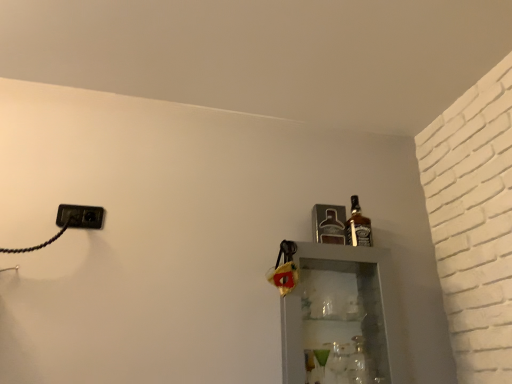
What is the approximate width of brown glass bottle at upper right, marked as the 1th bottle in a top-to-bottom arrangement?

It is 2.09 inches.

What is the approximate height of black plastic outlet at left?

9.02 centimeters.

Identify the location of metallic silver bottle at upper right, arranged as the 2th bottle when viewed from the top. (331, 225).

Are black plastic outlet at left and metallic silver bottle at upper right, arranged as the 2th bottle when viewed from the top, located far from each other?

No, there isn't a large distance between black plastic outlet at left and metallic silver bottle at upper right, arranged as the 2th bottle when viewed from the top.

How many degrees apart are the facing directions of black plastic outlet at left and metallic silver bottle at upper right, the 2th bottle when ordered from bottom to top?

The angular difference between black plastic outlet at left and metallic silver bottle at upper right, the 2th bottle when ordered from bottom to top, is 4.3 degrees.

Is point (65, 215) closer to viewer compared to point (331, 231)?

Yes, point (65, 215) is in front of point (331, 231).

Measure the distance between black plastic outlet at left and metallic silver bottle at upper right, the 2th bottle when ordered from bottom to top.

black plastic outlet at left and metallic silver bottle at upper right, the 2th bottle when ordered from bottom to top, are 34.85 inches apart from each other.

In the image, is clear glass bottle at right, the first bottle in the bottom-to-top sequence, positioned in front of or behind metallic silver bottle at upper right, the 2th bottle when ordered from bottom to top?

Visually, clear glass bottle at right, the first bottle in the bottom-to-top sequence, is located in front of metallic silver bottle at upper right, the 2th bottle when ordered from bottom to top.

From the image's perspective, is clear glass bottle at right, marked as the third bottle in a top-to-bottom arrangement, over metallic silver bottle at upper right, the 2th bottle when ordered from bottom to top?

No, from the image's perspective, clear glass bottle at right, marked as the third bottle in a top-to-bottom arrangement, is not on top of metallic silver bottle at upper right, the 2th bottle when ordered from bottom to top.

Where is `bottle located underneath the metallic silver bottle at upper right, the 2th bottle when ordered from bottom to top (from a real-world perspective)`? bottle located underneath the metallic silver bottle at upper right, the 2th bottle when ordered from bottom to top (from a real-world perspective) is located at coordinates (358, 363).

From a real-world perspective, is clear glass bottle at right, marked as the third bottle in a top-to-bottom arrangement, located higher than metallic silver bottle at upper right, the 2th bottle when ordered from bottom to top?

No.

This screenshot has width=512, height=384. What are the coordinates of `bottle that appears behind the brown glass bottle at upper right, marked as the 1th bottle in a top-to-bottom arrangement` in the screenshot? It's located at (331, 225).

Considering the sizes of objects metallic silver bottle at upper right, the 2th bottle when ordered from bottom to top, and brown glass bottle at upper right, marked as the 1th bottle in a top-to-bottom arrangement, in the image provided, who is thinner, metallic silver bottle at upper right, the 2th bottle when ordered from bottom to top, or brown glass bottle at upper right, marked as the 1th bottle in a top-to-bottom arrangement,?

With smaller width is brown glass bottle at upper right, marked as the 1th bottle in a top-to-bottom arrangement.

From the picture: Is metallic silver bottle at upper right, the 2th bottle when ordered from bottom to top, closer to the viewer compared to brown glass bottle at upper right, marked as the 1th bottle in a top-to-bottom arrangement?

No, metallic silver bottle at upper right, the 2th bottle when ordered from bottom to top, is further to the viewer.

Is metallic silver bottle at upper right, arranged as the 2th bottle when viewed from the top, positioned with its back to brown glass bottle at upper right, marked as the third bottle in a bottom-to-top arrangement?

No, metallic silver bottle at upper right, arranged as the 2th bottle when viewed from the top, is not facing the opposite direction of brown glass bottle at upper right, marked as the third bottle in a bottom-to-top arrangement.

Consider the image. Relative to black plastic outlet at left, is brown glass bottle at upper right, marked as the 1th bottle in a top-to-bottom arrangement, in front or behind?

brown glass bottle at upper right, marked as the 1th bottle in a top-to-bottom arrangement, is behind black plastic outlet at left.

Looking at this image, considering the relative positions of brown glass bottle at upper right, marked as the 1th bottle in a top-to-bottom arrangement, and black plastic outlet at left in the image provided, is brown glass bottle at upper right, marked as the 1th bottle in a top-to-bottom arrangement, to the right of black plastic outlet at left from the viewer's perspective?

Yes, brown glass bottle at upper right, marked as the 1th bottle in a top-to-bottom arrangement, is to the right of black plastic outlet at left.

From a real-world perspective, which object stands above the other?

brown glass bottle at upper right, marked as the 1th bottle in a top-to-bottom arrangement.

Considering the relative sizes of brown glass bottle at upper right, marked as the 1th bottle in a top-to-bottom arrangement, and clear glass bottle at right, marked as the third bottle in a top-to-bottom arrangement, in the image provided, is brown glass bottle at upper right, marked as the 1th bottle in a top-to-bottom arrangement, smaller than clear glass bottle at right, marked as the third bottle in a top-to-bottom arrangement,?

Incorrect, brown glass bottle at upper right, marked as the 1th bottle in a top-to-bottom arrangement, is not smaller in size than clear glass bottle at right, marked as the third bottle in a top-to-bottom arrangement.

Does point (364, 222) appear closer or farther from the camera than point (354, 383)?

Point (364, 222).

Would you say clear glass bottle at right, marked as the third bottle in a top-to-bottom arrangement, is part of brown glass bottle at upper right, marked as the 1th bottle in a top-to-bottom arrangement,'s contents?

No, clear glass bottle at right, marked as the third bottle in a top-to-bottom arrangement, is not inside brown glass bottle at upper right, marked as the 1th bottle in a top-to-bottom arrangement.

Looking at this image, how many degrees apart are the facing directions of brown glass bottle at upper right, marked as the 1th bottle in a top-to-bottom arrangement, and clear glass bottle at right, the first bottle in the bottom-to-top sequence?

They differ by 2.63 degrees in their facing directions.

Is metallic silver bottle at upper right, the 2th bottle when ordered from bottom to top, oriented towards black plastic outlet at left?

No, metallic silver bottle at upper right, the 2th bottle when ordered from bottom to top, is not facing towards black plastic outlet at left.

Is metallic silver bottle at upper right, the 2th bottle when ordered from bottom to top, spatially inside black plastic outlet at left, or outside of it?

metallic silver bottle at upper right, the 2th bottle when ordered from bottom to top, is located beyond the bounds of black plastic outlet at left.

Is metallic silver bottle at upper right, the 2th bottle when ordered from bottom to top, shorter than black plastic outlet at left?

No, metallic silver bottle at upper right, the 2th bottle when ordered from bottom to top, is not shorter than black plastic outlet at left.

From a real-world perspective, relative to black plastic outlet at left, is metallic silver bottle at upper right, arranged as the 2th bottle when viewed from the top, vertically above or below?

Clearly, from a real-world perspective, metallic silver bottle at upper right, arranged as the 2th bottle when viewed from the top, is below black plastic outlet at left.

Is black plastic outlet at left facing towards brown glass bottle at upper right, marked as the 1th bottle in a top-to-bottom arrangement?

No, black plastic outlet at left does not turn towards brown glass bottle at upper right, marked as the 1th bottle in a top-to-bottom arrangement.

Based on the photo, which is closer to the camera, (x=70, y=223) or (x=354, y=230)?

Point (x=70, y=223)

Between black plastic outlet at left and brown glass bottle at upper right, marked as the 1th bottle in a top-to-bottom arrangement, which one has larger size?

brown glass bottle at upper right, marked as the 1th bottle in a top-to-bottom arrangement.

Does black plastic outlet at left touch brown glass bottle at upper right, marked as the third bottle in a bottom-to-top arrangement?

No, black plastic outlet at left is not next to brown glass bottle at upper right, marked as the third bottle in a bottom-to-top arrangement.

The image size is (512, 384). I want to click on the 1st bottle to the right of the black plastic outlet at left, starting your count from the anchor, so click(x=331, y=225).

The image size is (512, 384). In the image, there is a metallic silver bottle at upper right, the 2th bottle when ordered from bottom to top. Identify the location of bottle below it (from a real-world perspective). (358, 363).

Considering their positions, is brown glass bottle at upper right, marked as the third bottle in a bottom-to-top arrangement, positioned further to metallic silver bottle at upper right, the 2th bottle when ordered from bottom to top, than clear glass bottle at right, the first bottle in the bottom-to-top sequence?

Among the two, clear glass bottle at right, the first bottle in the bottom-to-top sequence, is located further to metallic silver bottle at upper right, the 2th bottle when ordered from bottom to top.

Which object lies nearer to the anchor point black plastic outlet at left, metallic silver bottle at upper right, the 2th bottle when ordered from bottom to top, or brown glass bottle at upper right, marked as the third bottle in a bottom-to-top arrangement?

metallic silver bottle at upper right, the 2th bottle when ordered from bottom to top, is positioned closer to the anchor black plastic outlet at left.

Estimate the real-world distances between objects in this image. Which object is further from clear glass bottle at right, marked as the third bottle in a top-to-bottom arrangement, brown glass bottle at upper right, marked as the third bottle in a bottom-to-top arrangement, or black plastic outlet at left?

Based on the image, black plastic outlet at left appears to be further to clear glass bottle at right, marked as the third bottle in a top-to-bottom arrangement.

Considering their positions, is black plastic outlet at left positioned closer to metallic silver bottle at upper right, the 2th bottle when ordered from bottom to top, than brown glass bottle at upper right, marked as the third bottle in a bottom-to-top arrangement?

brown glass bottle at upper right, marked as the third bottle in a bottom-to-top arrangement, is closer to metallic silver bottle at upper right, the 2th bottle when ordered from bottom to top.

Based on their spatial positions, is black plastic outlet at left or brown glass bottle at upper right, marked as the 1th bottle in a top-to-bottom arrangement, closer to clear glass bottle at right, the first bottle in the bottom-to-top sequence?

brown glass bottle at upper right, marked as the 1th bottle in a top-to-bottom arrangement.

Looking at the image, which one is located closer to clear glass bottle at right, marked as the third bottle in a top-to-bottom arrangement, black plastic outlet at left or metallic silver bottle at upper right, the 2th bottle when ordered from bottom to top?

metallic silver bottle at upper right, the 2th bottle when ordered from bottom to top, is closer to clear glass bottle at right, marked as the third bottle in a top-to-bottom arrangement.

Looking at the image, which one is located further to clear glass bottle at right, marked as the third bottle in a top-to-bottom arrangement, metallic silver bottle at upper right, arranged as the 2th bottle when viewed from the top, or black plastic outlet at left?

black plastic outlet at left lies further to clear glass bottle at right, marked as the third bottle in a top-to-bottom arrangement, than the other object.

From the image, which object appears to be nearer to black plastic outlet at left, brown glass bottle at upper right, marked as the 1th bottle in a top-to-bottom arrangement, or metallic silver bottle at upper right, the 2th bottle when ordered from bottom to top?

Based on the image, metallic silver bottle at upper right, the 2th bottle when ordered from bottom to top, appears to be nearer to black plastic outlet at left.

The height and width of the screenshot is (384, 512). I want to click on bottle located between black plastic outlet at left and clear glass bottle at right, marked as the third bottle in a top-to-bottom arrangement, in the left-right direction, so click(x=331, y=225).

The width and height of the screenshot is (512, 384). What are the coordinates of `bottle between brown glass bottle at upper right, marked as the 1th bottle in a top-to-bottom arrangement, and clear glass bottle at right, the first bottle in the bottom-to-top sequence, from top to bottom` in the screenshot? It's located at (331, 225).